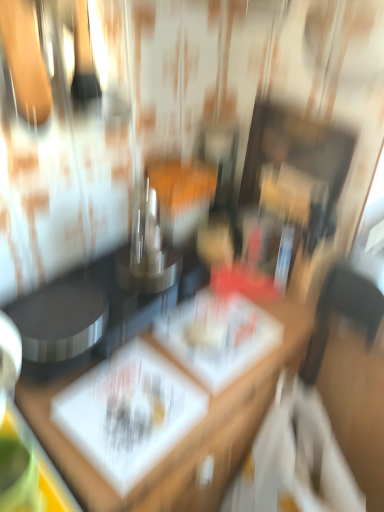
This screenshot has width=384, height=512. What do you see at coordinates (170, 408) in the screenshot?
I see `wooden table at center` at bounding box center [170, 408].

Identify the location of wooden table at center. (170, 408).

Image resolution: width=384 pixels, height=512 pixels. I want to click on wooden table at center, so click(170, 408).